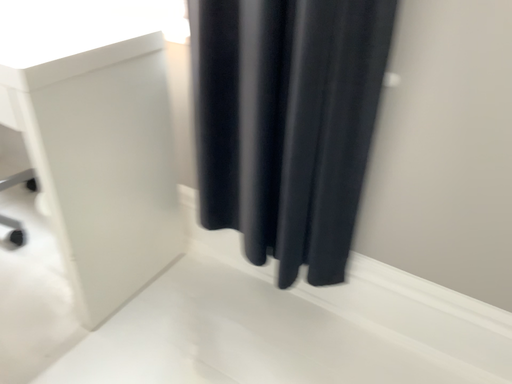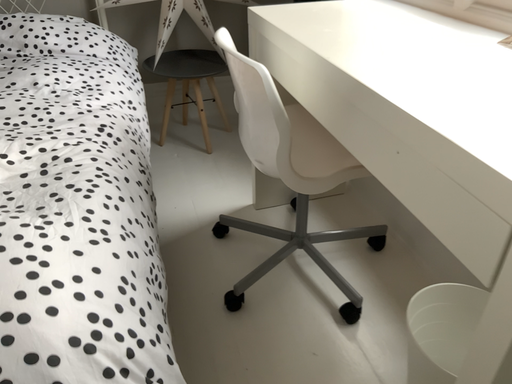
Question: How did the camera likely rotate when shooting the video?

Choices:
 (A) rotated left
 (B) rotated right

Answer: (A)